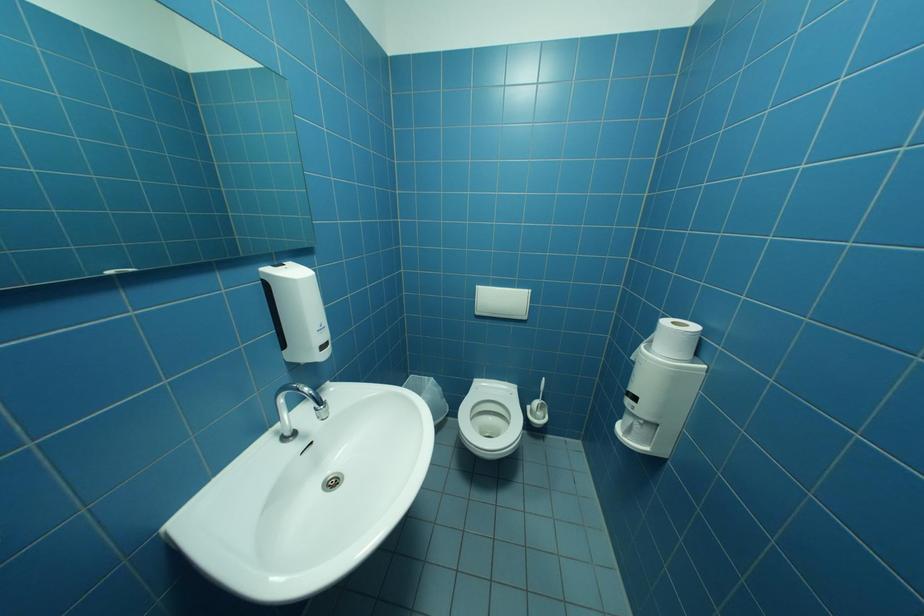
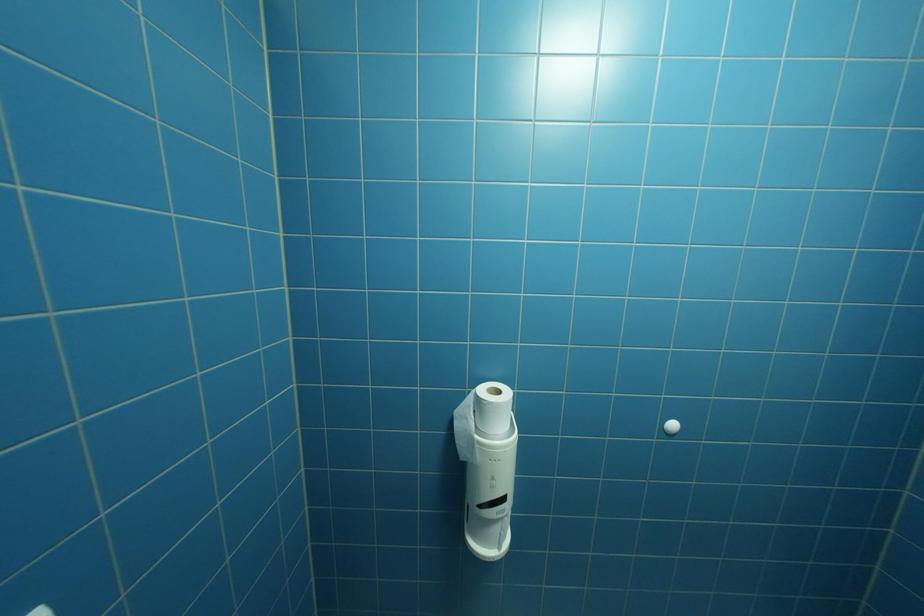
Question: The images are taken continuously from a first-person perspective. In which direction is your viewpoint rotating?

Choices:
 (A) Left
 (B) Right
 (C) Up
 (D) Down

Answer: (B)